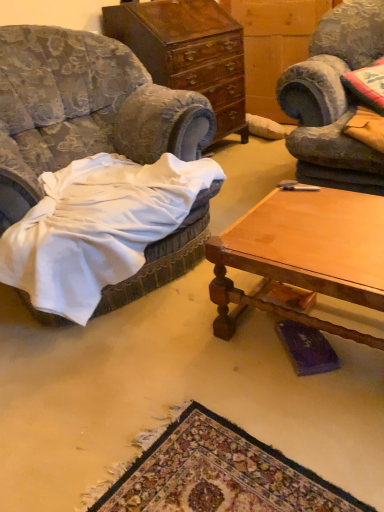
What do you see at coordinates (83, 110) in the screenshot? I see `velvet blue armchair at left` at bounding box center [83, 110].

What is the approximate height of velvet blue armchair at left?

It is 92.52 centimeters.

This screenshot has width=384, height=512. What do you see at coordinates (303, 255) in the screenshot?
I see `wooden polished coffee table at center` at bounding box center [303, 255].

The height and width of the screenshot is (512, 384). Find the location of `velvet blue armchair at left`. velvet blue armchair at left is located at coordinates click(83, 110).

From a real-world perspective, is wooden polished coffee table at center beneath polished wood cabinet at center?

Indeed, from a real-world perspective, wooden polished coffee table at center is positioned beneath polished wood cabinet at center.

Does wooden polished coffee table at center appear on the right side of polished wood cabinet at center?

Indeed, wooden polished coffee table at center is positioned on the right side of polished wood cabinet at center.

This screenshot has width=384, height=512. Identify the location of cabinetry above the wooden polished coffee table at center (from a real-world perspective). (188, 52).

Is wooden polished coffee table at center situated inside polished wood cabinet at center or outside?

wooden polished coffee table at center is not inside polished wood cabinet at center, it's outside.

Considering the sizes of objects velvet blue armchair at left and wooden polished coffee table at center in the image provided, who is thinner, velvet blue armchair at left or wooden polished coffee table at center?

With smaller width is wooden polished coffee table at center.

Between velvet blue armchair at left and wooden polished coffee table at center, which one has less height?

wooden polished coffee table at center.

Locate an element on the screen. The width and height of the screenshot is (384, 512). chair above the wooden polished coffee table at center (from the image's perspective) is located at coordinates (83, 110).

Does velvet blue armchair at left touch wooden polished coffee table at center?

There is a gap between velvet blue armchair at left and wooden polished coffee table at center.

Is polished wood cabinet at center looking in the opposite direction of wooden polished coffee table at center?

No, wooden polished coffee table at center is not at the back of polished wood cabinet at center.

Would you say polished wood cabinet at center is outside wooden polished coffee table at center?

Yes, polished wood cabinet at center is not within wooden polished coffee table at center.

Looking at this image, which of these two, polished wood cabinet at center or wooden polished coffee table at center, is bigger?

polished wood cabinet at center.

Which object is wider, wooden polished coffee table at center or velvet blue armchair at left?

velvet blue armchair at left is wider.

Does wooden polished coffee table at center appear on the right side of velvet blue armchair at left?

Correct, you'll find wooden polished coffee table at center to the right of velvet blue armchair at left.

Are wooden polished coffee table at center and velvet blue armchair at left far apart?

That's not correct — wooden polished coffee table at center is a little close to velvet blue armchair at left.

Based on the photo, is velvet blue armchair at left a part of wooden polished coffee table at center?

Actually, velvet blue armchair at left is outside wooden polished coffee table at center.

Image resolution: width=384 pixels, height=512 pixels. Identify the location of chair in front of the polished wood cabinet at center. (83, 110).

Does velvet blue armchair at left have a greater height compared to polished wood cabinet at center?

In fact, velvet blue armchair at left may be shorter than polished wood cabinet at center.

Which object is thinner, velvet blue armchair at left or polished wood cabinet at center?

Thinner between the two is polished wood cabinet at center.

Is polished wood cabinet at center positioned in front of velvet blue armchair at left?

No, it is not.

Which is less distant, (168, 21) or (145, 128)?

Point (145, 128)

Is polished wood cabinet at center positioned far away from velvet blue armchair at left?

No.

From the picture: From the image's perspective, which one is positioned higher, polished wood cabinet at center or velvet blue armchair at left?

polished wood cabinet at center.

The width and height of the screenshot is (384, 512). I want to click on coffee table on the right of polished wood cabinet at center, so click(303, 255).

I want to click on coffee table below the velvet blue armchair at left (from the image's perspective), so 303,255.

When comparing their distances from polished wood cabinet at center, does wooden polished coffee table at center or velvet blue armchair at left seem further?

wooden polished coffee table at center.

In the scene shown: Considering their positions, is wooden polished coffee table at center positioned further to velvet blue armchair at left than polished wood cabinet at center?

polished wood cabinet at center is further to velvet blue armchair at left.

From the image, which object appears to be farther from wooden polished coffee table at center, velvet blue armchair at left or polished wood cabinet at center?

polished wood cabinet at center.

Consider the image. Estimate the real-world distances between objects in this image. Which object is further from wooden polished coffee table at center, polished wood cabinet at center or velvet blue armchair at left?

polished wood cabinet at center is positioned further to the anchor wooden polished coffee table at center.

Based on their spatial positions, is polished wood cabinet at center or wooden polished coffee table at center closer to velvet blue armchair at left?

wooden polished coffee table at center is closer to velvet blue armchair at left.

Which object lies nearer to the anchor point polished wood cabinet at center, velvet blue armchair at left or wooden polished coffee table at center?

Among the two, velvet blue armchair at left is located nearer to polished wood cabinet at center.

Find the location of a particular element. coffee table between velvet blue armchair at left and polished wood cabinet at center from front to back is located at coordinates (303, 255).